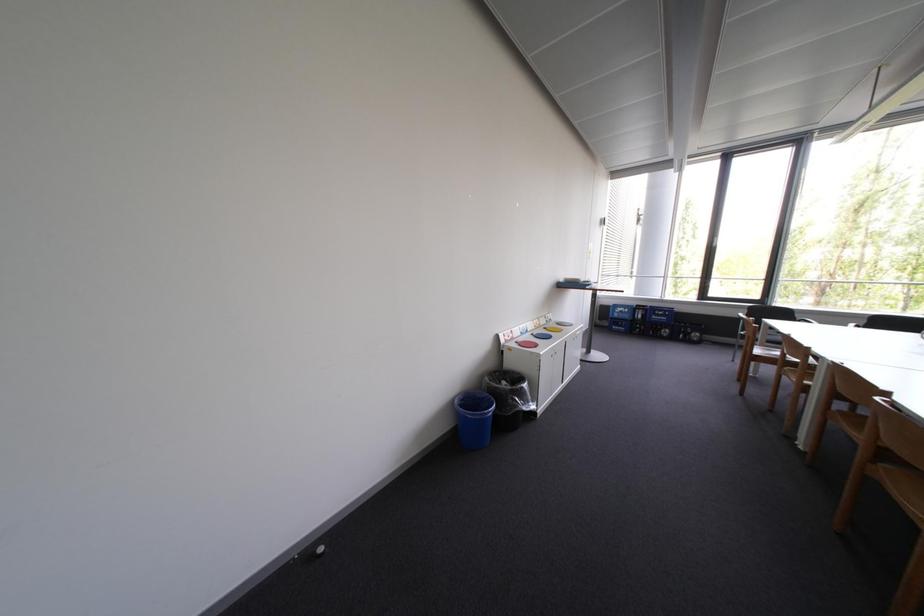
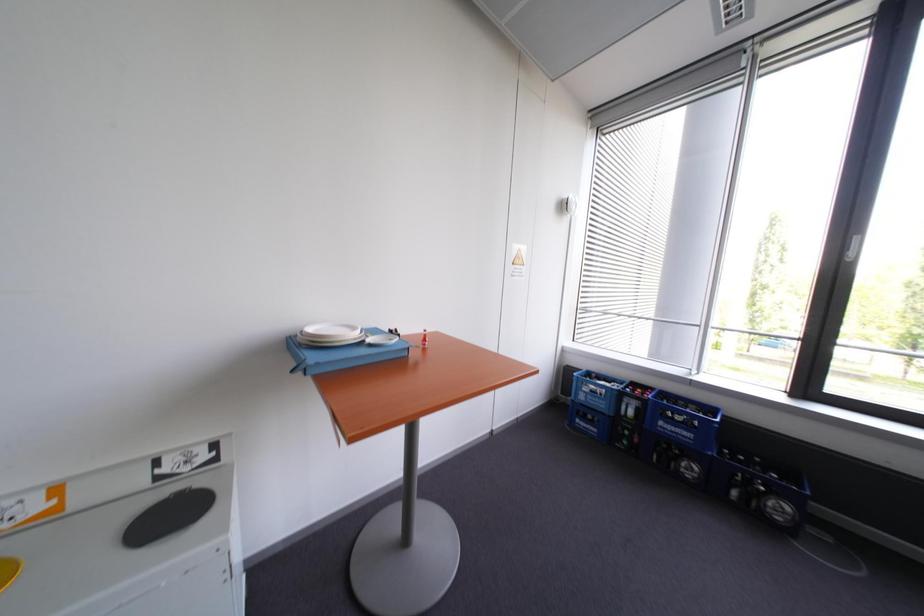
What movement of the cameraman would produce the second image?

The cameraman walked toward right, forward.